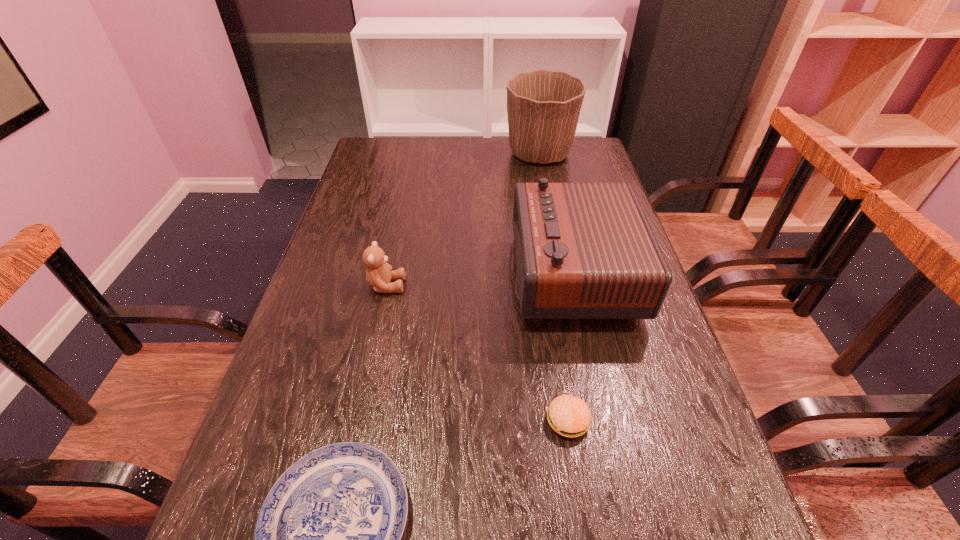
At what (x,y) coordinates should I click in order to perform the action: click on free space located on the face of the teddy bear. Please return your answer as a coordinate pair (x, y). Image resolution: width=960 pixels, height=540 pixels. Looking at the image, I should click on (483, 286).

Locate an element on the screen. This screenshot has height=540, width=960. free space located on the left of the second shortest object is located at coordinates (514, 420).

Identify the location of object located at the far edge. (543, 106).

This screenshot has height=540, width=960. What are the coordinates of `object situated at the left edge` in the screenshot? It's located at (378, 274).

What are the coordinates of `flowerpot that is positioned at the right edge` in the screenshot? It's located at (543, 106).

Where is `radio receiver that is at the right edge`? radio receiver that is at the right edge is located at coordinates (583, 250).

Where is `object that is at the far right corner`? object that is at the far right corner is located at coordinates (543, 106).

What are the coordinates of `vacant space at the far edge` in the screenshot? It's located at (459, 143).

This screenshot has height=540, width=960. I want to click on vacant region at the left edge of the desktop, so click(x=303, y=449).

Where is `vacant region at the right edge of the desktop`? vacant region at the right edge of the desktop is located at coordinates (680, 435).